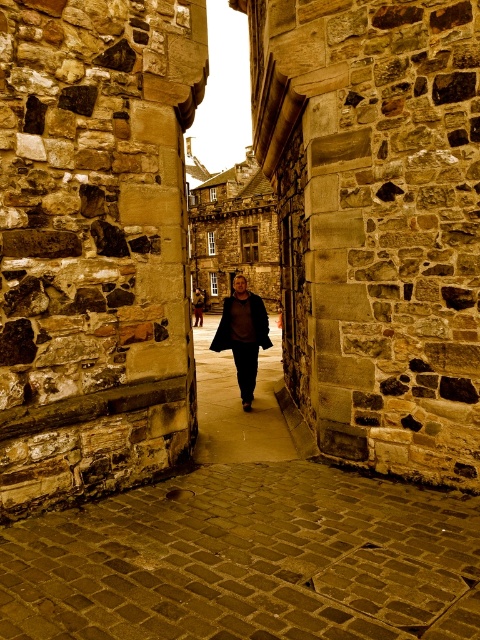
How far apart are dark brown leather jacket at center and matte brown coat at center?

dark brown leather jacket at center and matte brown coat at center are 43.05 feet apart from each other.

Who is lower down, dark brown leather jacket at center or matte brown coat at center?

dark brown leather jacket at center is lower down.

This screenshot has height=640, width=480. Find the location of `dark brown leather jacket at center`. dark brown leather jacket at center is located at coordinates (238, 404).

Identify the location of dark brown leather jacket at center. The image size is (480, 640). (238, 404).